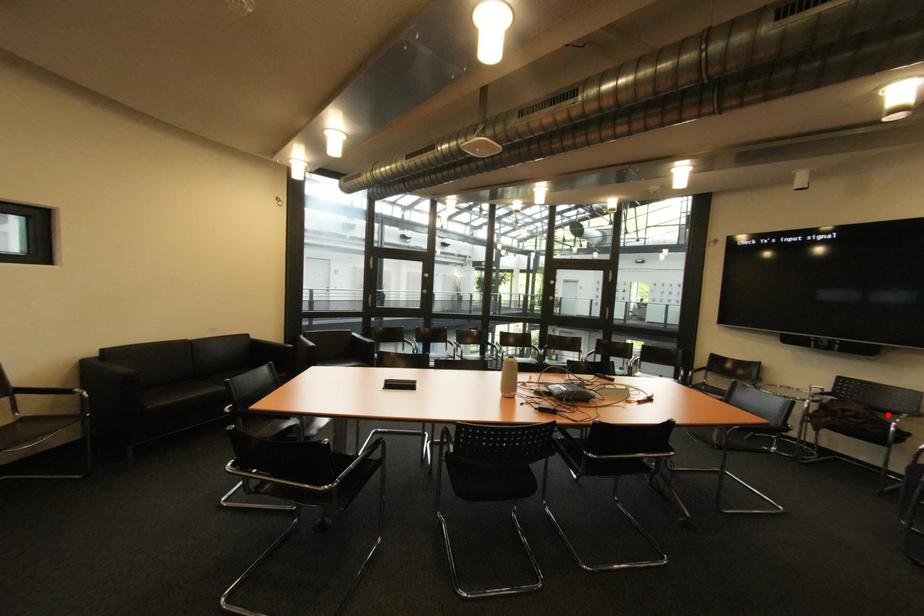
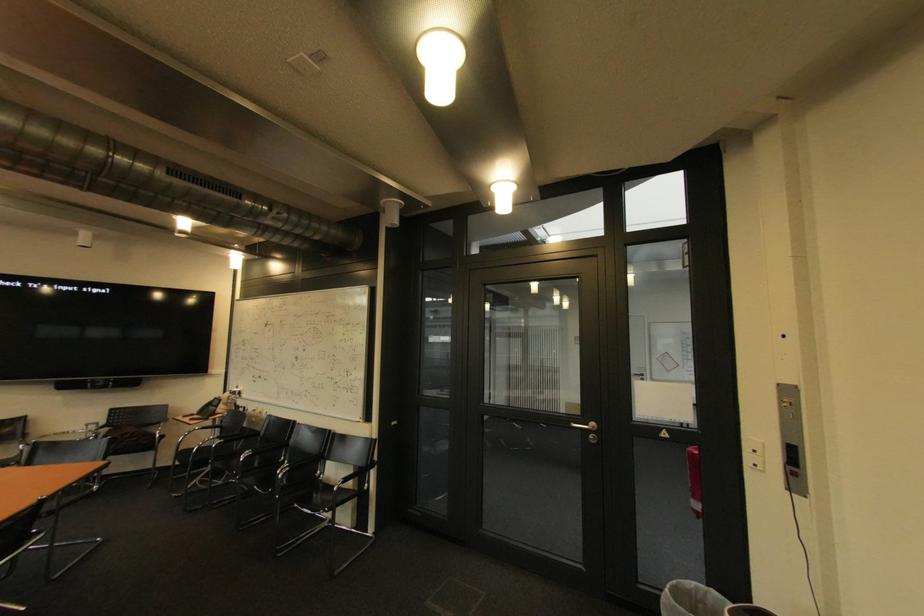
Question: I am providing you with two images of the same scene from different viewpoints. A red point is shown in image1. For the corresponding object point in image2, is it positioned nearer or farther from the camera?

Choices:
 (A) Nearer
 (B) Farther

Answer: (A)